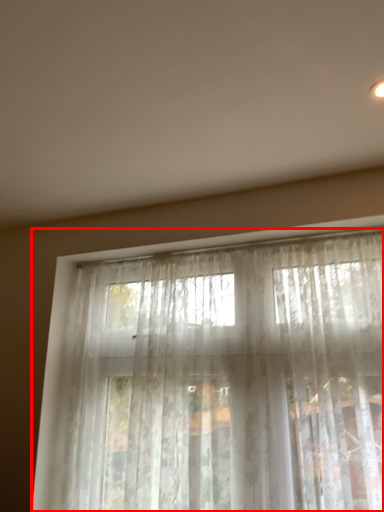
Question: Considering the relative positions of curtain (annotated by the red box) and backdrop in the image provided, where is curtain (annotated by the red box) located with respect to the staircase?

Choices:
 (A) right
 (B) left

Answer: (A)